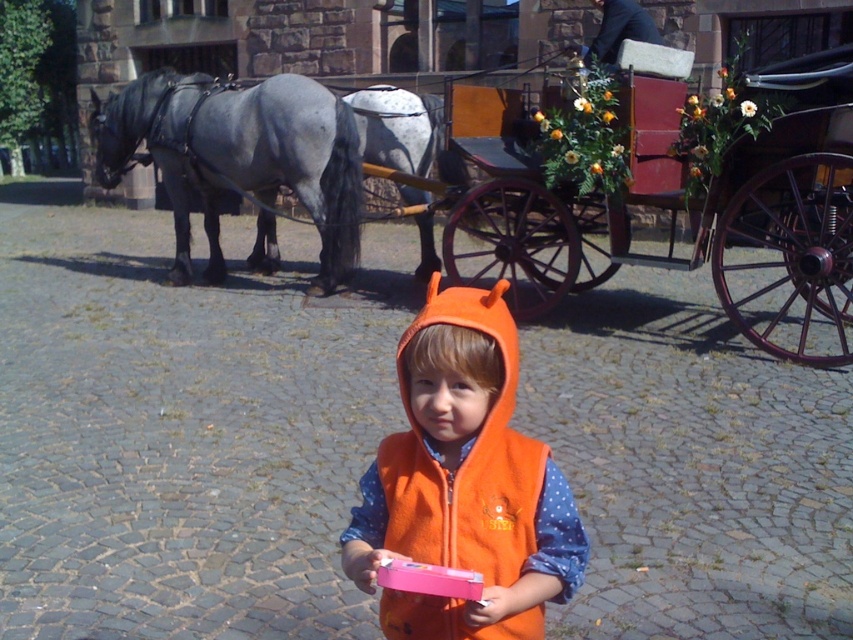
Is gray glossy horse at left wider than gray matte horse at center?

Indeed, gray glossy horse at left has a greater width compared to gray matte horse at center.

Identify the location of gray glossy horse at left. (239, 156).

Does point (357, 214) come farther from viewer compared to point (396, 93)?

No, (357, 214) is in front of (396, 93).

Where is `gray glossy horse at left`? Image resolution: width=853 pixels, height=640 pixels. gray glossy horse at left is located at coordinates (239, 156).

Can you confirm if gray matte horse at center is positioned to the left of wooden coach at upper center?

Yes, gray matte horse at center is to the left of wooden coach at upper center.

Which is more to the right, gray matte horse at center or wooden coach at upper center?

From the viewer's perspective, wooden coach at upper center appears more on the right side.

At what (x,y) coordinates should I click in order to perform the action: click on gray matte horse at center. Please return your answer as a coordinate pair (x, y). Image resolution: width=853 pixels, height=640 pixels. Looking at the image, I should click on (404, 132).

Is gray glossy horse at left below wooden coach at upper center?

Yes, gray glossy horse at left is below wooden coach at upper center.

Does gray glossy horse at left have a lesser width compared to wooden coach at upper center?

Result: No, gray glossy horse at left is not thinner than wooden coach at upper center.

Who is more forward, (257, 218) or (577, 51)?

Point (577, 51) is more forward.

You are a GUI agent. You are given a task and a screenshot of the screen. Output one action in this format:
    pyautogui.click(x=<x>, y=<y>)
    Task: Click on the gray glossy horse at left
    
    Given the screenshot: What is the action you would take?
    pyautogui.click(x=239, y=156)